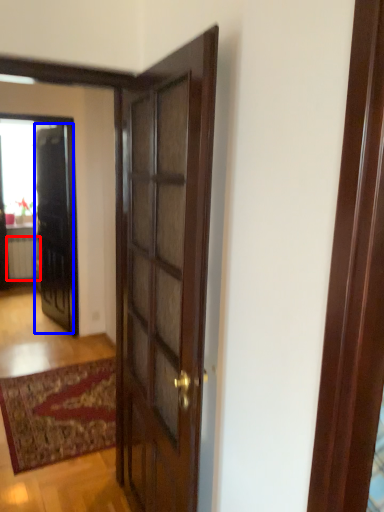
Question: Among these objects, which one is nearest to the camera, radiator (highlighted by a red box) or door (highlighted by a blue box)?

Choices:
 (A) radiator
 (B) door

Answer: (B)